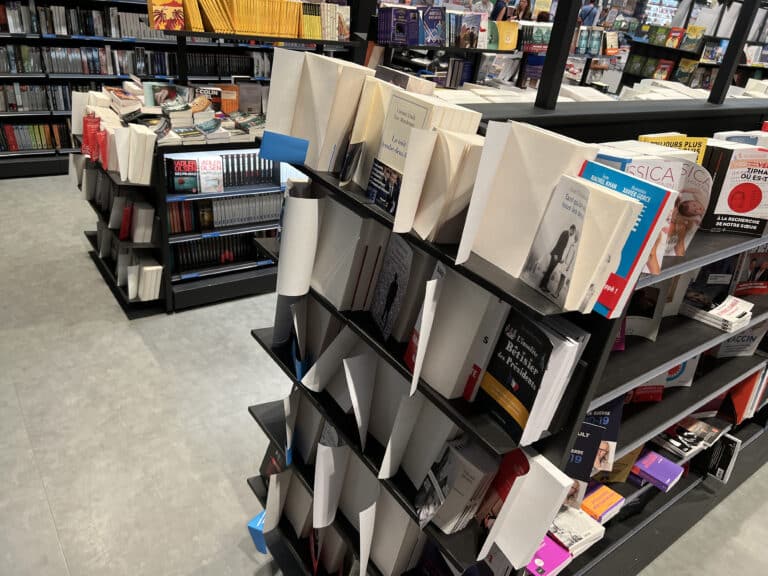
Locate an element on the screen. The width and height of the screenshot is (768, 576). purple book on bottom shelf is located at coordinates (670, 473).